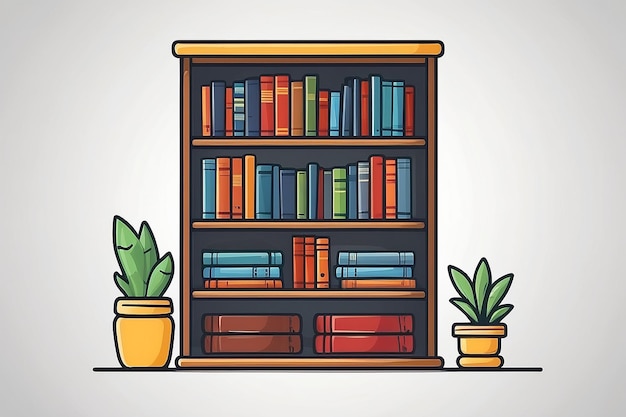
What are the coordinates of `shelves` in the screenshot? It's located at (310, 364), (310, 294), (295, 227), (302, 141).